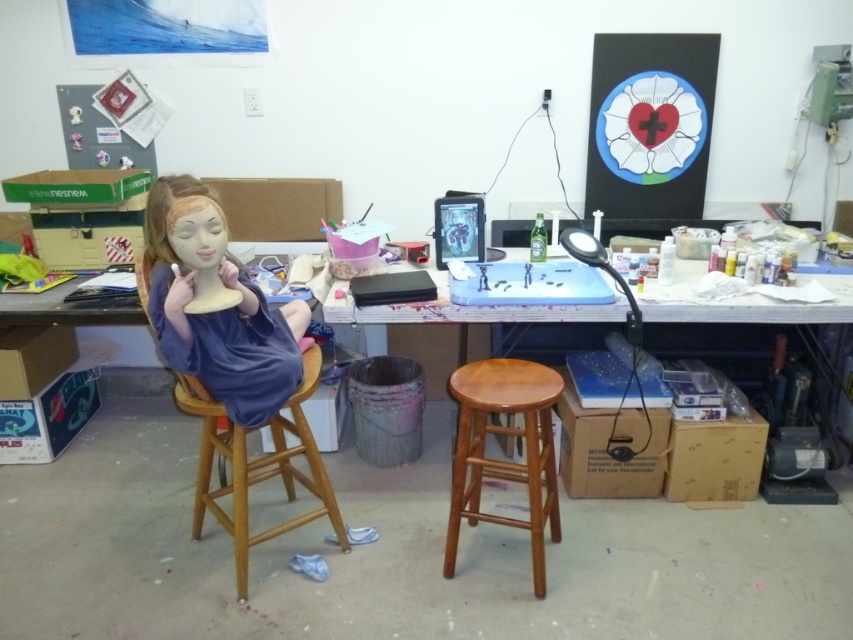
Is light brown wood stool at center below wooden stool at center?

Indeed, light brown wood stool at center is positioned under wooden stool at center.

Does light brown wood stool at center appear over wooden stool at center?

Actually, light brown wood stool at center is below wooden stool at center.

Where is `light brown wood stool at center`? The height and width of the screenshot is (640, 853). light brown wood stool at center is located at coordinates (502, 460).

Is point (224, 387) farther from viewer compared to point (200, 502)?

No.

Can you confirm if velvet blue dress at center is thinner than wooden stool at center?

Yes, velvet blue dress at center is thinner than wooden stool at center.

Is point (171, 348) in front of point (265, 476)?

That is True.

This screenshot has height=640, width=853. In order to click on velvet blue dress at center in this screenshot , I will do `click(213, 307)`.

Does light brown wood stool at center appear on the left side of wooden desk at center?

Yes, light brown wood stool at center is to the left of wooden desk at center.

From the picture: Who is lower down, light brown wood stool at center or wooden desk at center?

Positioned lower is light brown wood stool at center.

Which is in front, point (448, 522) or point (724, 301)?

Positioned in front is point (724, 301).

Identify the location of light brown wood stool at center. The width and height of the screenshot is (853, 640). (502, 460).